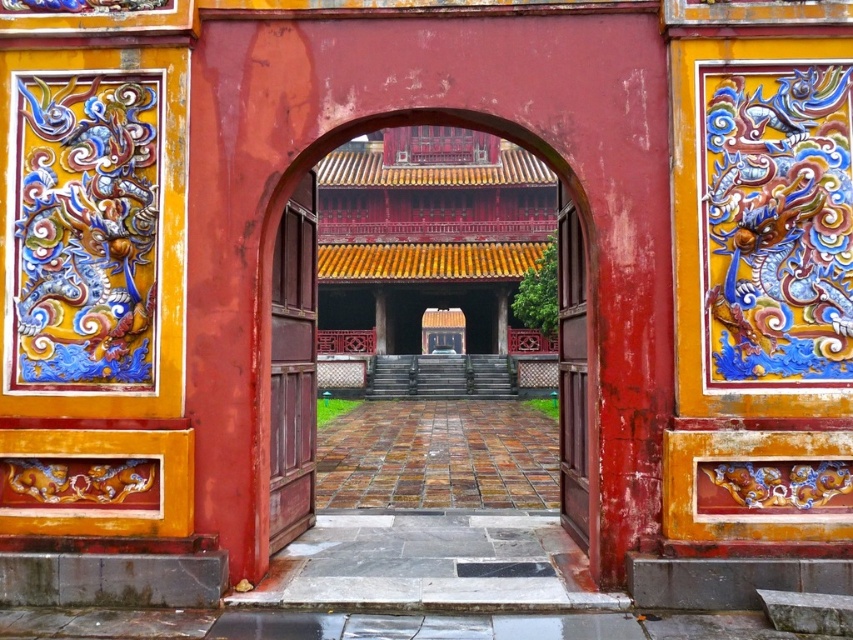
Question: Is wooden door at center further to camera compared to smooth wood door at center?

Choices:
 (A) no
 (B) yes

Answer: (A)

Question: Is wooden door at center below smooth wood door at center?

Choices:
 (A) no
 (B) yes

Answer: (A)

Question: Which point is farther to the camera?

Choices:
 (A) (567, 362)
 (B) (419, 275)
 (C) (314, 468)

Answer: (B)

Question: Which point appears farthest from the camera in this image?

Choices:
 (A) (560, 301)
 (B) (376, 186)
 (C) (293, 432)

Answer: (B)

Question: Which point is farther to the camera?

Choices:
 (A) wooden door at center
 (B) polished wood door at center
 (C) smooth wood door at center

Answer: (C)

Question: Is wooden door at center behind smooth wood door at center?

Choices:
 (A) no
 (B) yes

Answer: (A)